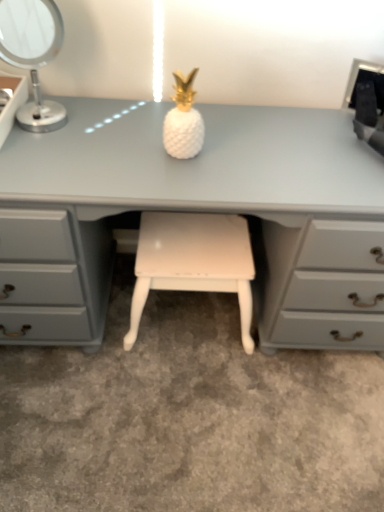
Where is `free region under silver metallic table lamp at upper left (from a real-world perspective)`? The width and height of the screenshot is (384, 512). free region under silver metallic table lamp at upper left (from a real-world perspective) is located at coordinates (50, 130).